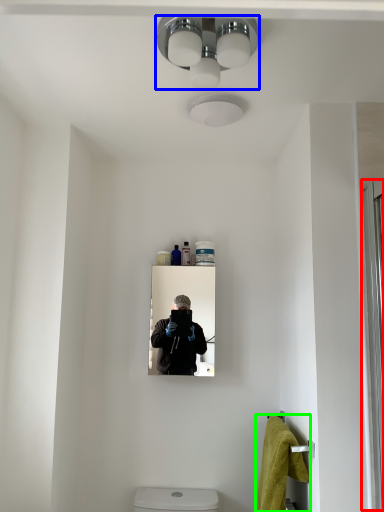
Question: Considering the real-world distances, which object is farthest from screen door (highlighted by a red box)? light fixture (highlighted by a blue box) or bath towel (highlighted by a green box)?

Choices:
 (A) light fixture
 (B) bath towel

Answer: (A)